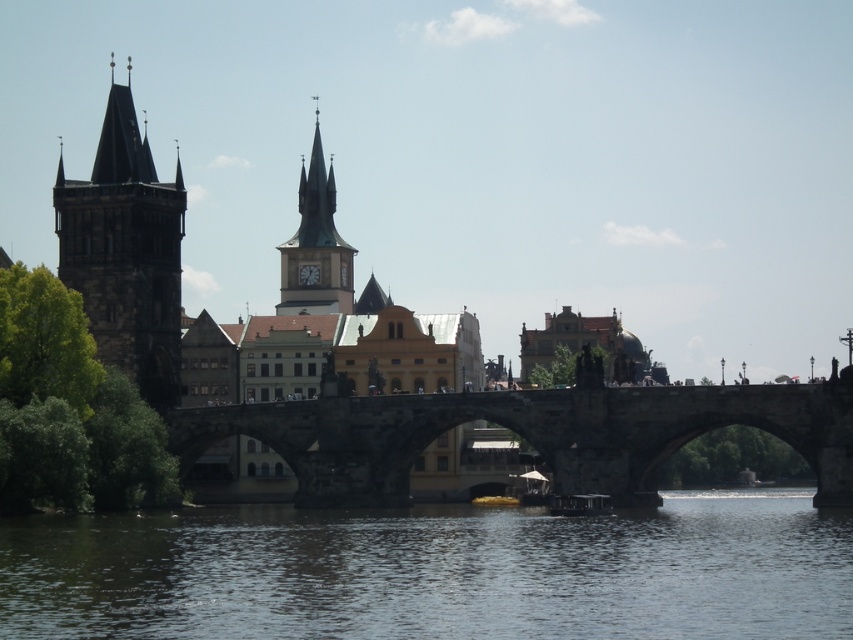
Does point (602, 589) lie in front of point (312, 228)?

Yes, it is.

Is transparent water at lower center closer to camera compared to smooth stone clock tower at center?

Yes, it is.

The width and height of the screenshot is (853, 640). Identify the location of transparent water at lower center. pos(434,572).

Who is positioned more to the right, transparent water at lower center or dark stone tower at left?

Positioned to the right is transparent water at lower center.

Between transparent water at lower center and dark stone tower at left, which one is positioned lower?

transparent water at lower center

Who is more forward, (x=770, y=532) or (x=141, y=392)?

Point (x=770, y=532) is in front.

Locate an element on the screen. Image resolution: width=853 pixels, height=640 pixels. transparent water at lower center is located at coordinates (434, 572).

Is transparent water at lower center to the left of brown stone bridge at center from the viewer's perspective?

Indeed, transparent water at lower center is positioned on the left side of brown stone bridge at center.

Between point (326, 544) and point (183, 461), which one is positioned behind?

The point (183, 461) is more distant.

Where is `transparent water at lower center`? The image size is (853, 640). transparent water at lower center is located at coordinates (434, 572).